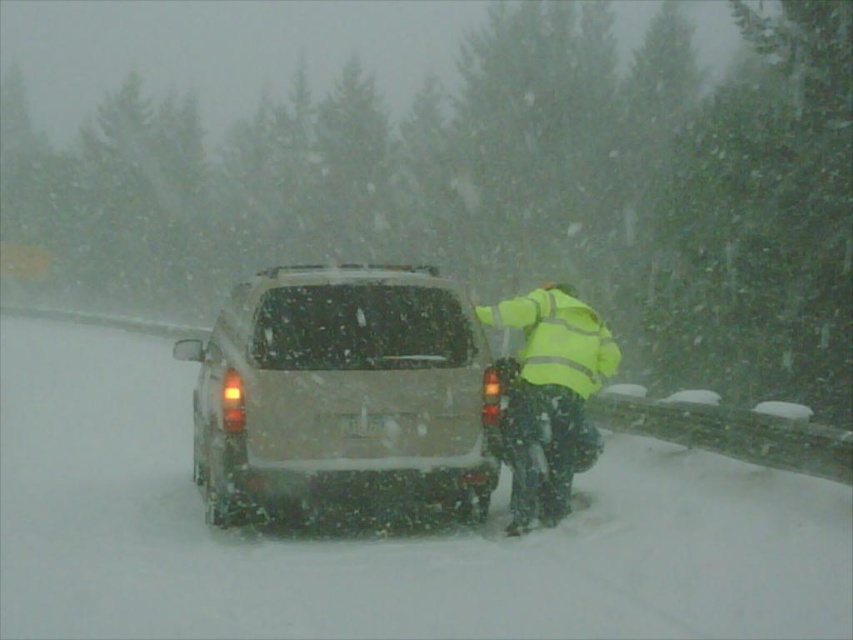
Can you confirm if white powdery snow at center is shorter than white plastic license plate at center?

Incorrect, white powdery snow at center's height does not fall short of white plastic license plate at center's.

Is white powdery snow at center bigger than white plastic license plate at center?

Yes, white powdery snow at center is bigger than white plastic license plate at center.

The image size is (853, 640). What are the coordinates of `white powdery snow at center` in the screenshot? It's located at (378, 538).

I want to click on white powdery snow at center, so click(378, 538).

Does matte silver minivan at center have a lesser width compared to white plastic license plate at center?

No, matte silver minivan at center is not thinner than white plastic license plate at center.

Is matte silver minivan at center shorter than white plastic license plate at center?

In fact, matte silver minivan at center may be taller than white plastic license plate at center.

Which is behind, point (238, 372) or point (361, 436)?

Point (361, 436)

The image size is (853, 640). What are the coordinates of `matte silver minivan at center` in the screenshot? It's located at [x=341, y=394].

Is white powdery snow at center to the right of high-visibility fabric jacket at lower right from the viewer's perspective?

In fact, white powdery snow at center is to the left of high-visibility fabric jacket at lower right.

Describe the element at coordinates (378, 538) in the screenshot. Image resolution: width=853 pixels, height=640 pixels. I see `white powdery snow at center` at that location.

At what (x,y) coordinates should I click in order to perform the action: click on white powdery snow at center. Please return your answer as a coordinate pair (x, y). Looking at the image, I should click on (378, 538).